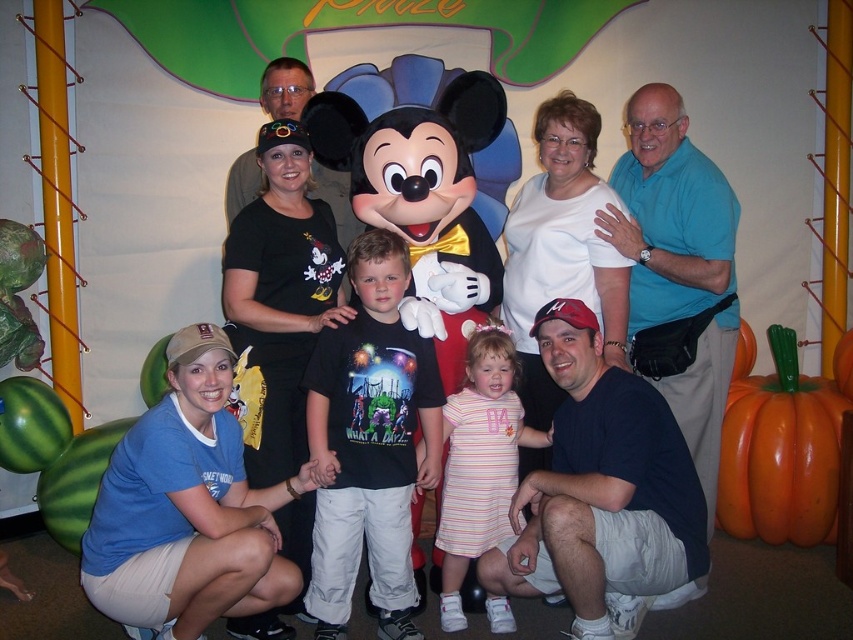
Can you confirm if matte black t-shirt at center is wider than striped cotton dress at center?

Indeed, matte black t-shirt at center has a greater width compared to striped cotton dress at center.

Is matte black t-shirt at center below striped cotton dress at center?

Incorrect, matte black t-shirt at center is not positioned below striped cotton dress at center.

In order to click on matte black t-shirt at center in this screenshot , I will do `click(508, 225)`.

Is blue cotton shirt at upper right taller than striped cotton dress at center?

Yes, blue cotton shirt at upper right is taller than striped cotton dress at center.

Where is `blue cotton shirt at upper right`? This screenshot has width=853, height=640. blue cotton shirt at upper right is located at coordinates point(677,269).

Measure the distance between blue cotton shirt at upper right and camera.

The distance of blue cotton shirt at upper right from camera is 2.66 meters.

What are the coordinates of `blue cotton shirt at upper right` in the screenshot? It's located at [677, 269].

Is blue cotton t-shirt at lower left above striped cotton dress at center?

Yes.

Who is higher up, blue cotton t-shirt at lower left or striped cotton dress at center?

blue cotton t-shirt at lower left is higher up.

Which is behind, point (206, 525) or point (451, 524)?

Point (451, 524)

Where is `blue cotton t-shirt at lower left`? The image size is (853, 640). blue cotton t-shirt at lower left is located at coordinates (187, 508).